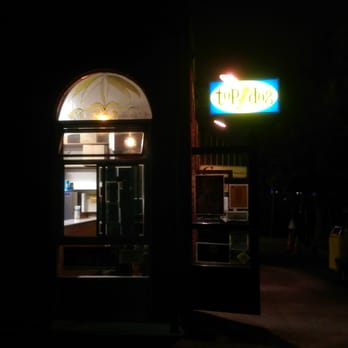
You are a GUI agent. You are given a task and a screenshot of the screen. Output one action in this format:
    pyautogui.click(x=<x>, y=<y>)
    Task: Click on the counter top
    This screenshot has height=348, width=348.
    Given the screenshot: What is the action you would take?
    pyautogui.click(x=82, y=220)